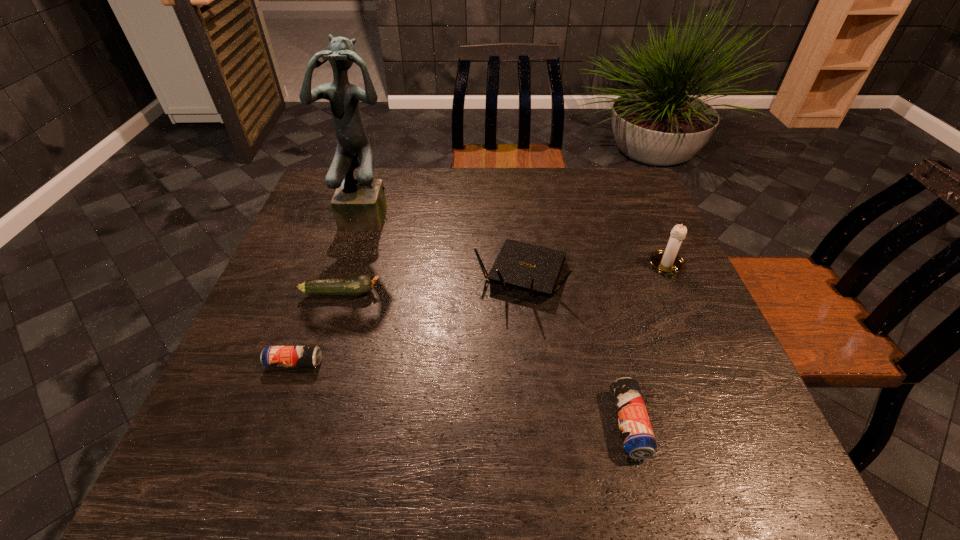
Image resolution: width=960 pixels, height=540 pixels. I want to click on free point between the farther beer can and the zucchini, so click(319, 328).

I want to click on free point between the nearest object and the fifth shortest object, so [648, 346].

Locate an element on the screen. This screenshot has height=540, width=960. free space between the sculpture and the zucchini is located at coordinates (356, 253).

Where is `empty space between the zucchini and the farthest object`? empty space between the zucchini and the farthest object is located at coordinates (356, 253).

Locate an element on the screen. blank region between the zucchini and the left beer can is located at coordinates (319, 328).

Image resolution: width=960 pixels, height=540 pixels. Identify the location of free space between the zucchini and the third object from right to left. (432, 284).

Identify which object is located as the fourth nearest to the taller beer can. Please provide its 2D coordinates. Your answer should be formatted as a tuple, i.e. [(x, y)], where the tuple contains the x and y coordinates of a point satisfying the conditions above.

[(273, 356)]

Point out which object is positioned as the fifth nearest to the candle holder. Please provide its 2D coordinates. Your answer should be formatted as a tuple, i.e. [(x, y)], where the tuple contains the x and y coordinates of a point satisfying the conditions above.

[(273, 356)]

This screenshot has width=960, height=540. I want to click on vacant position in the image that satisfies the following two spatial constraints: 1. on the face of the farthest object; 2. on the right side of the router, so click(x=352, y=275).

You are a GUI agent. You are given a task and a screenshot of the screen. Output one action in this format:
    pyautogui.click(x=<x>, y=<y>)
    Task: Click on the free space in the image that satisfies the following two spatial constraints: 1. on the face of the nearer beer can; 2. on the left side of the farthest object
    The image size is (960, 540).
    Given the screenshot: What is the action you would take?
    pyautogui.click(x=307, y=424)